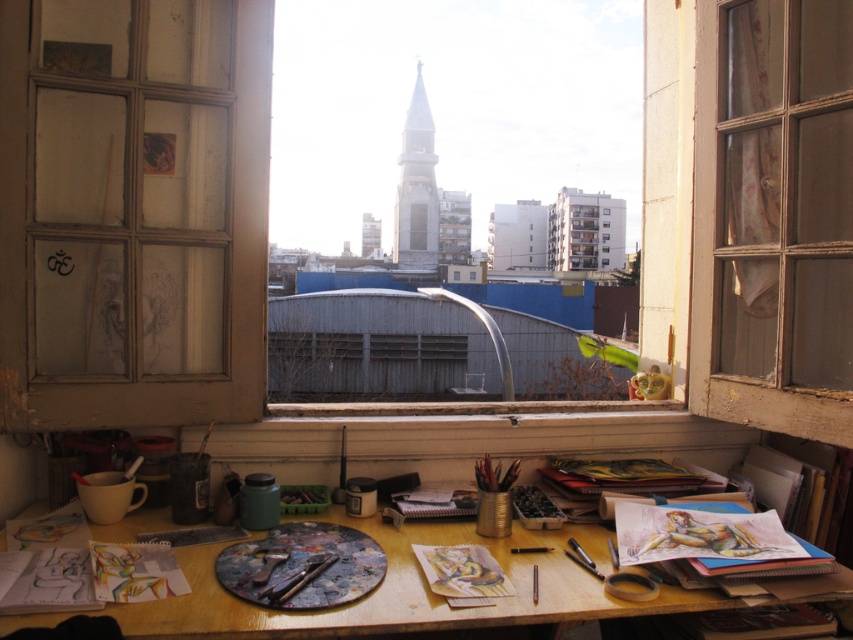
Does point (28, 273) come in front of point (743, 154)?

Yes.

Is wooden window frame at left taller than wooden frame at center?

Incorrect, wooden window frame at left's height is not larger of wooden frame at center's.

Does point (136, 186) come farther from viewer compared to point (773, 266)?

No, it is not.

Find the location of a particular element. wooden window frame at left is located at coordinates (138, 224).

Can you confirm if wooden frame at center is positioned to the right of wooden table at center?

Yes, wooden frame at center is to the right of wooden table at center.

What do you see at coordinates (773, 216) in the screenshot?
I see `wooden frame at center` at bounding box center [773, 216].

Where is `wooden frame at center`? wooden frame at center is located at coordinates (773, 216).

Image resolution: width=853 pixels, height=640 pixels. In order to click on wooden frame at center in this screenshot , I will do `click(773, 216)`.

Does wooden window frame at left appear under wooden table at center?

No.

Is point (195, 177) closer to camera compared to point (355, 621)?

No, it is behind (355, 621).

Does point (65, 145) come closer to viewer compared to point (666, 600)?

No, (65, 145) is behind (666, 600).

I want to click on wooden window frame at left, so click(x=138, y=224).